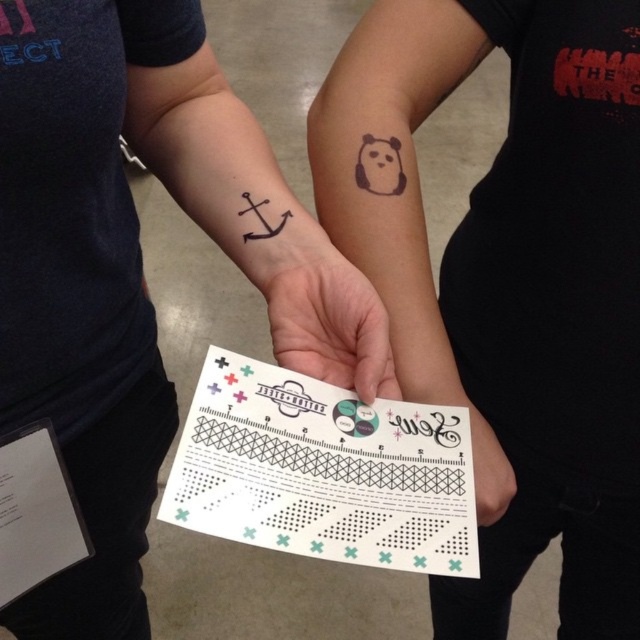
You are a guest at a tattoo parlor and see the white matte paper at center and the black ink anchor at left. Which object is positioned lower in the image?

The white matte paper at center is positioned below the black ink anchor at left, so it is lower in the image.